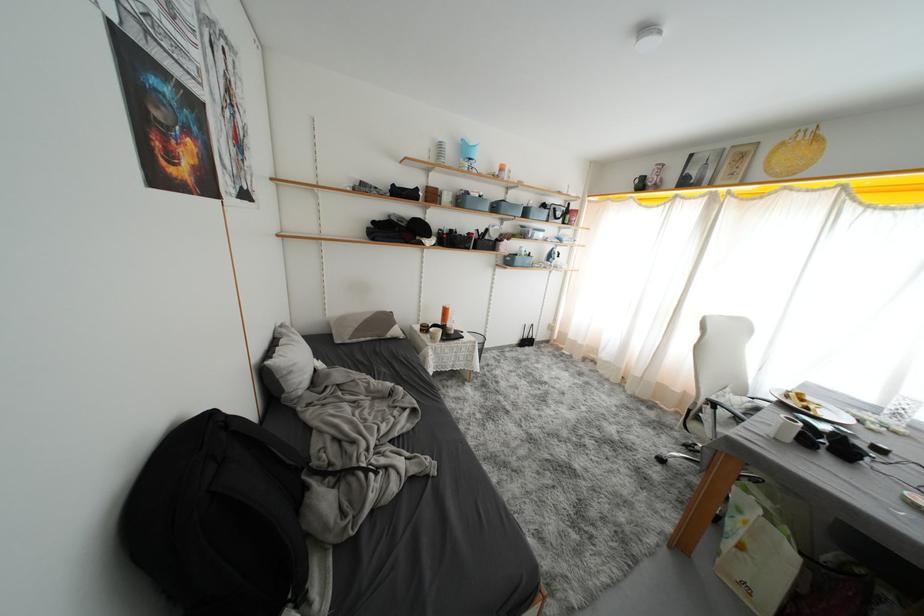
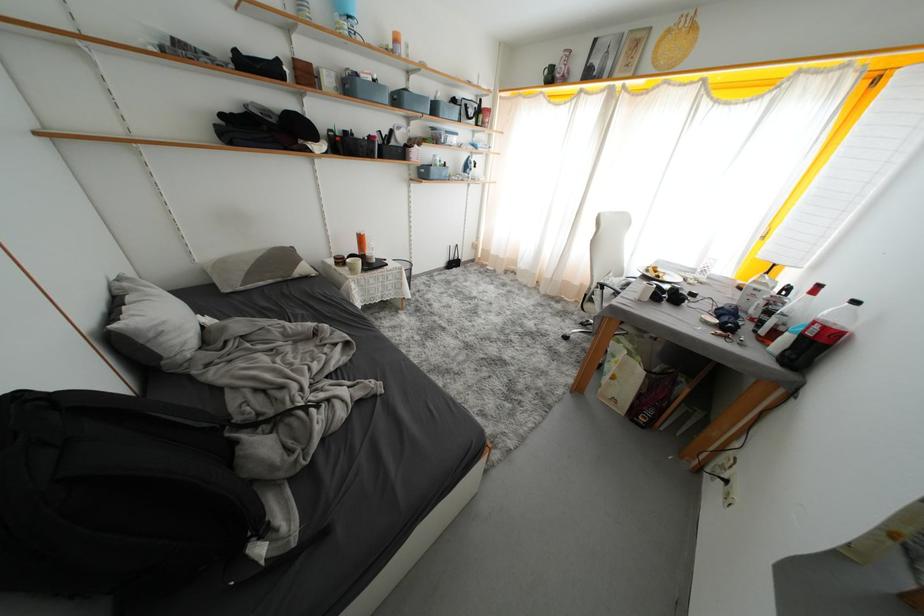
Where in the second image is the point corresponding to point (696, 415) from the first image?

(591, 299)